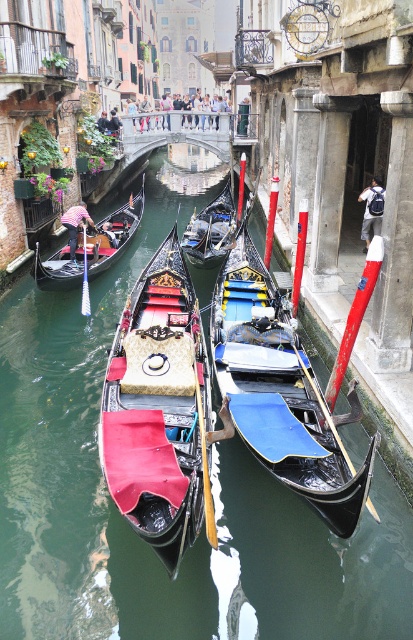
Question: Which of the following is the closest to the observer?

Choices:
 (A) black polished wood gondola at center
 (B) velvet red gondola at center

Answer: (A)

Question: Which point is closer to the camera?

Choices:
 (A) (299, 365)
 (B) (206, 467)

Answer: (B)

Question: Considering the relative positions of velvet red gondola at center and black polished wood gondola at center in the image provided, where is velvet red gondola at center located with respect to black polished wood gondola at center?

Choices:
 (A) below
 (B) above

Answer: (A)

Question: Considering the relative positions of velvet red gondola at center and black polished wood gondola at center in the image provided, where is velvet red gondola at center located with respect to black polished wood gondola at center?

Choices:
 (A) above
 (B) below

Answer: (B)

Question: Which point is farther from the camera taking this photo?

Choices:
 (A) (249, 323)
 (B) (116, 390)

Answer: (A)

Question: Does velvet red gondola at center appear over black polished wood gondola at center?

Choices:
 (A) no
 (B) yes

Answer: (A)